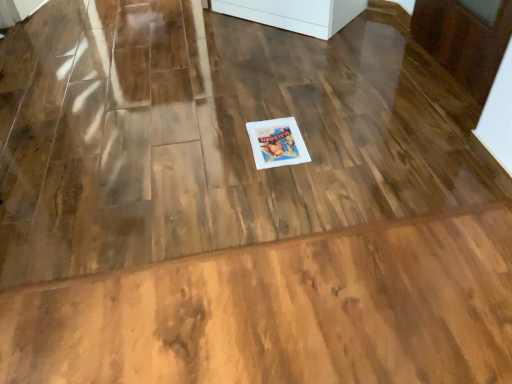
What is the approximate height of white glossy comic book at center?

It is 3.30 centimeters.

Measure the distance between white glossy comic book at center and camera.

white glossy comic book at center and camera are 5.21 feet apart.

Image resolution: width=512 pixels, height=384 pixels. What do you see at coordinates (277, 143) in the screenshot? I see `white glossy comic book at center` at bounding box center [277, 143].

Identify the location of white glossy comic book at center. The image size is (512, 384). (277, 143).

This screenshot has height=384, width=512. I want to click on white glossy comic book at center, so click(277, 143).